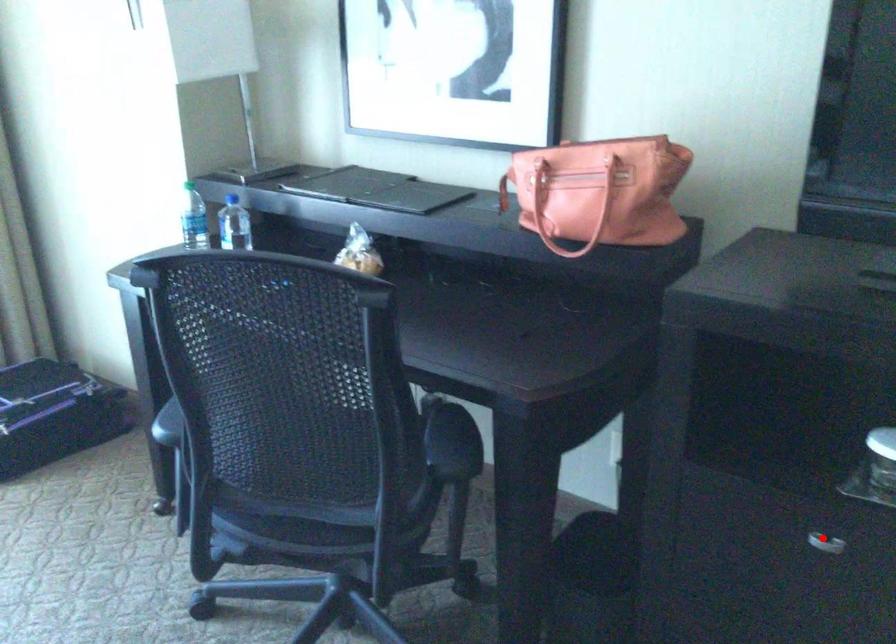
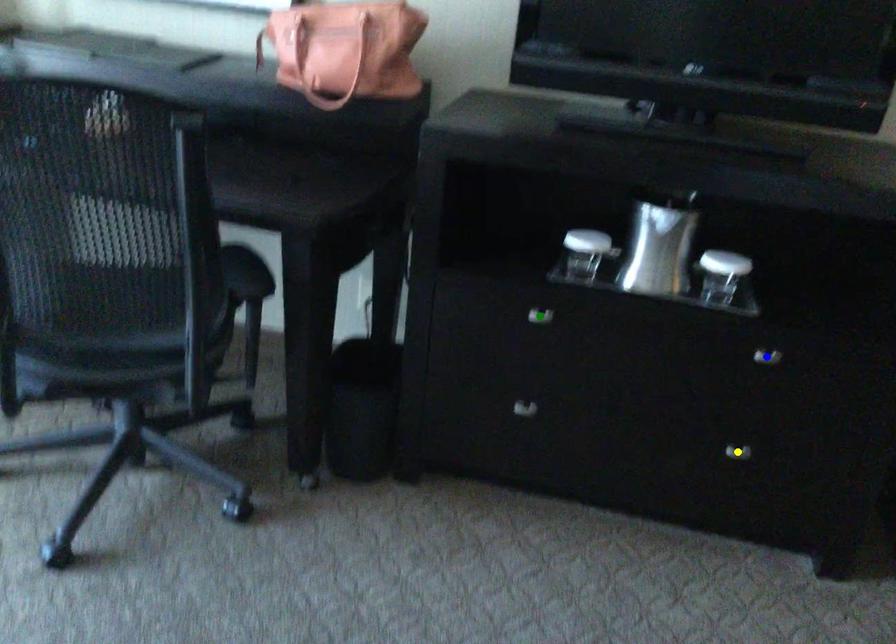
Question: I am providing you with two images of the same scene from different viewpoints. A red point is marked on the first image. You are given multiple points on the second image. Which mark in image 2 goes with the point in image 1?

Choices:
 (A) blue point
 (B) green point
 (C) yellow point

Answer: (B)